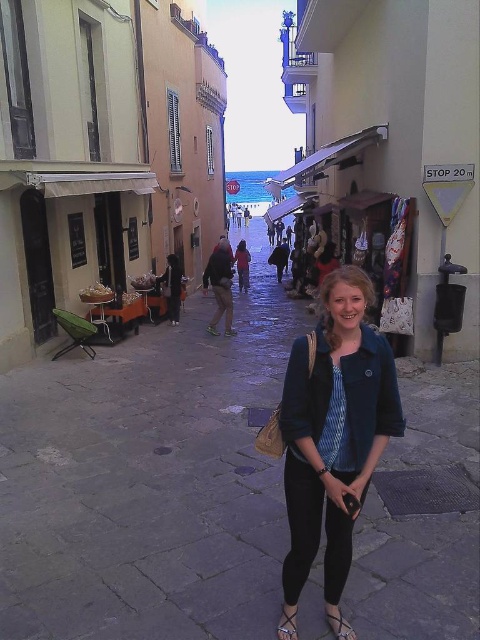
Question: Among these points, which one is farthest from the camera?

Choices:
 (A) (333, 628)
 (B) (282, 618)

Answer: (B)

Question: Considering the relative positions of denim jacket at center and leather sandal at lower center in the image provided, where is denim jacket at center located with respect to leather sandal at lower center?

Choices:
 (A) left
 (B) right

Answer: (B)

Question: Which point appears farthest from the camera in this image?

Choices:
 (A) (330, 449)
 (B) (334, 605)
 (C) (277, 634)

Answer: (B)

Question: Does black leather sandal at lower center have a smaller size compared to leather sandal at lower center?

Choices:
 (A) no
 (B) yes

Answer: (A)

Question: Is denim jacket at center above black leather sandal at lower center?

Choices:
 (A) no
 (B) yes

Answer: (B)

Question: Which of the following is the farthest from the observer?

Choices:
 (A) (327, 609)
 (B) (289, 621)

Answer: (A)